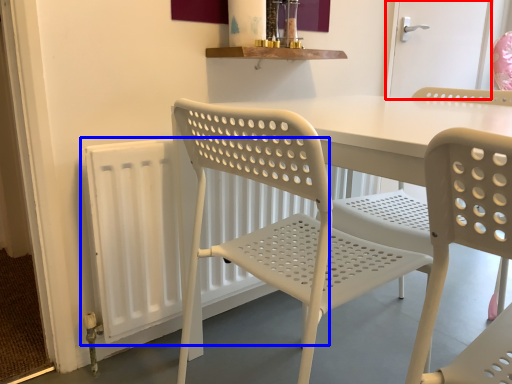
Question: Which object is closer to the camera taking this photo, screen door (highlighted by a red box) or radiator (highlighted by a blue box)?

Choices:
 (A) screen door
 (B) radiator

Answer: (B)